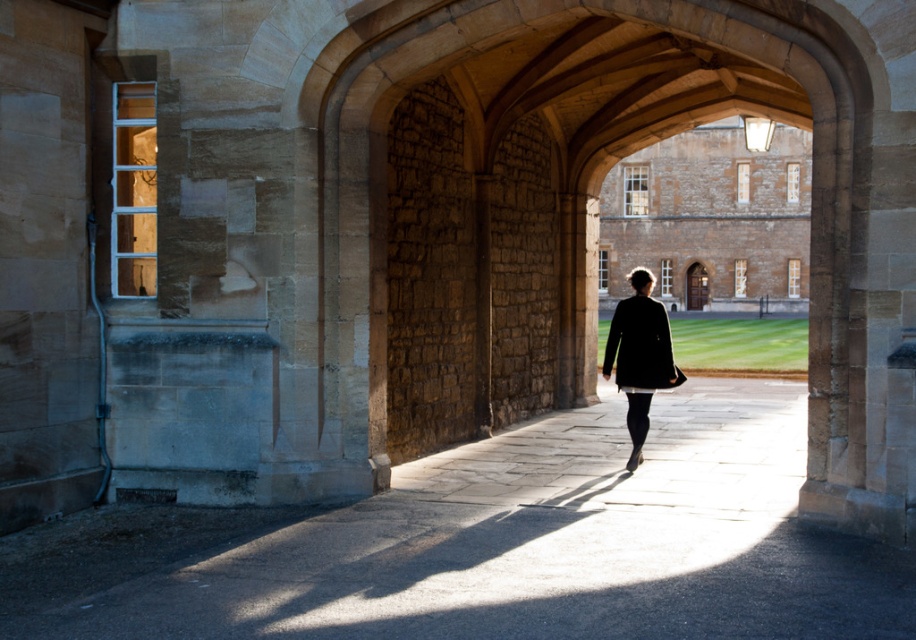
You are standing in the historic stone building and want to follow the person in the matte black coat at center. Which direction should you move relative to the smooth stone pathway at center to catch up with them?

You should move to the right of the smooth stone pathway at center because the matte black coat at center is to the right of the pathway, so following that direction would lead you towards the person.

You are standing at the entrance of the historic stone building and see the smooth stone pathway at center and the black matte coat at center. Which object is closer to your right side?

The black matte coat at center is closer to your right side because the smooth stone pathway at center is to the left of it.